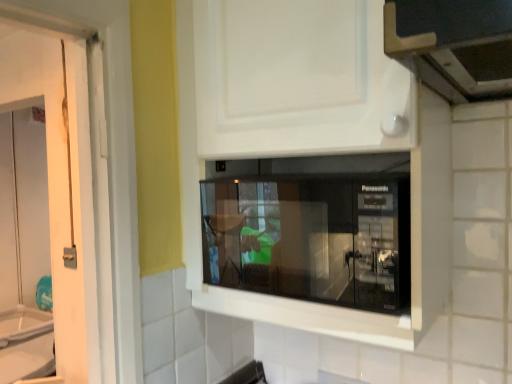
Question: Does matte black microwave at center have a larger size compared to black glossy microwave at center?

Choices:
 (A) yes
 (B) no

Answer: (A)

Question: Is matte black microwave at center facing away from black glossy microwave at center?

Choices:
 (A) no
 (B) yes

Answer: (B)

Question: From the image's perspective, does matte black microwave at center appear lower than black glossy microwave at center?

Choices:
 (A) no
 (B) yes

Answer: (A)

Question: Is matte black microwave at center further to the viewer compared to black glossy microwave at center?

Choices:
 (A) no
 (B) yes

Answer: (A)

Question: Does matte black microwave at center have a greater height compared to black glossy microwave at center?

Choices:
 (A) no
 (B) yes

Answer: (B)

Question: Would you consider matte black microwave at center to be distant from black glossy microwave at center?

Choices:
 (A) no
 (B) yes

Answer: (A)

Question: Does black glossy microwave at center come in front of matte black microwave at center?

Choices:
 (A) no
 (B) yes

Answer: (A)

Question: From a real-world perspective, is black glossy microwave at center physically above matte black microwave at center?

Choices:
 (A) yes
 (B) no

Answer: (B)

Question: From the image's perspective, is black glossy microwave at center beneath matte black microwave at center?

Choices:
 (A) yes
 (B) no

Answer: (A)

Question: From the image's perspective, is black glossy microwave at center over matte black microwave at center?

Choices:
 (A) no
 (B) yes

Answer: (A)

Question: Is black glossy microwave at center shorter than matte black microwave at center?

Choices:
 (A) no
 (B) yes

Answer: (B)

Question: Considering the relative sizes of black glossy microwave at center and matte black microwave at center in the image provided, is black glossy microwave at center bigger than matte black microwave at center?

Choices:
 (A) no
 (B) yes

Answer: (A)

Question: From the image's perspective, relative to matte black microwave at center, is black glossy microwave at center above or below?

Choices:
 (A) below
 (B) above

Answer: (A)